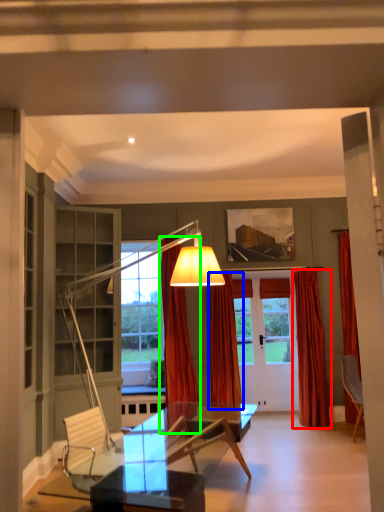
Question: Considering the real-world distances, which object is closest to curtain (highlighted by a red box)? curtain (highlighted by a blue box) or curtain (highlighted by a green box).

Choices:
 (A) curtain
 (B) curtain

Answer: (A)